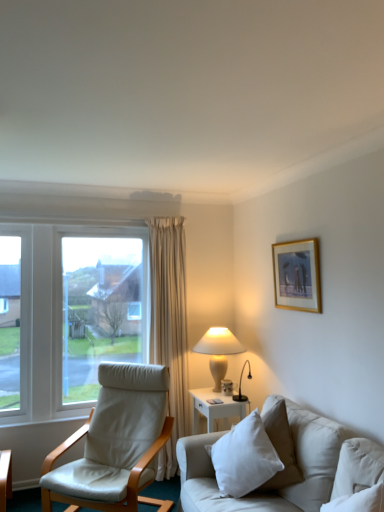
Describe the element at coordinates (358, 467) in the screenshot. I see `white soft pillow at lower right, the 1th pillow positioned from the front` at that location.

Describe the element at coordinates (297, 275) in the screenshot. The width and height of the screenshot is (384, 512). I see `gold-framed artwork at upper right` at that location.

At what (x,y) coordinates should I click in order to perform the action: click on white leather chair at left. Please return your answer as a coordinate pair (x, y). Image resolution: width=384 pixels, height=512 pixels. Looking at the image, I should click on (115, 443).

I want to click on white cotton pillow at lower right, which is the second pillow from right to left, so click(244, 457).

I want to click on white ceramic table lamp at center-right, so pos(218,351).

Can you confirm if white soft pillow at lower right, which is the second pillow in left-to-right order, is taller than white cotton pillow at lower right, the 1th pillow positioned from the left?

Incorrect, the height of white soft pillow at lower right, which is the second pillow in left-to-right order, is not larger of that of white cotton pillow at lower right, the 1th pillow positioned from the left.

Consider the image. Is white cotton pillow at lower right, the 1th pillow positioned from the left, at the back of white soft pillow at lower right, which is the second pillow in left-to-right order?

No, white soft pillow at lower right, which is the second pillow in left-to-right order, is not facing the opposite direction of white cotton pillow at lower right, the 1th pillow positioned from the left.

Is white soft pillow at lower right, the 1th pillow positioned from the front, bigger or smaller than white cotton pillow at lower right, the 1th pillow positioned from the left?

Considering their sizes, white soft pillow at lower right, the 1th pillow positioned from the front, takes up less space than white cotton pillow at lower right, the 1th pillow positioned from the left.

Considering the relative positions of white ceramic table lamp at center-right and white cotton pillow at lower right, the 2th pillow viewed from the front, in the image provided, is white ceramic table lamp at center-right to the left of white cotton pillow at lower right, the 2th pillow viewed from the front, from the viewer's perspective?

Yes.

Could you measure the distance between white ceramic table lamp at center-right and white cotton pillow at lower right, the 2th pillow viewed from the front?

white ceramic table lamp at center-right is 37.30 inches away from white cotton pillow at lower right, the 2th pillow viewed from the front.

From the picture: Is white ceramic table lamp at center-right directly adjacent to white cotton pillow at lower right, the 2th pillow viewed from the front?

No.

Which is behind, white ceramic table lamp at center-right or white cotton pillow at lower right, the 2th pillow viewed from the front?

white ceramic table lamp at center-right is further from the camera.

Is white soft pillow at lower right, the 1th pillow positioned from the front, positioned far away from white ceramic table lamp at center-right?

Indeed, white soft pillow at lower right, the 1th pillow positioned from the front, is not near white ceramic table lamp at center-right.

Which is behind, point (338, 471) or point (209, 334)?

Positioned behind is point (209, 334).

Is white soft pillow at lower right, positioned as the 2th pillow in back-to-front order, outside of white ceramic table lamp at center-right?

Yes, white soft pillow at lower right, positioned as the 2th pillow in back-to-front order, is not within white ceramic table lamp at center-right.

How many degrees apart are the facing directions of white soft pillow at lower right, which is the second pillow in left-to-right order, and white ceramic table lamp at center-right?

The angle between the facing direction of white soft pillow at lower right, which is the second pillow in left-to-right order, and the facing direction of white ceramic table lamp at center-right is 17.2 degrees.

Is point (124, 446) positioned behind point (233, 352)?

No, it is in front of (233, 352).

From a real-world perspective, which is physically below, white leather chair at left or white ceramic table lamp at center-right?

white leather chair at left.

Is white leather chair at left behind white ceramic table lamp at center-right?

That is False.

Is the surface of white leather chair at left in direct contact with white ceramic table lamp at center-right?

No, white leather chair at left is not touching white ceramic table lamp at center-right.

Looking at the image, does white cotton pillow at lower right, which is the second pillow from right to left, seem bigger or smaller compared to white soft pillow at lower right, positioned as the 2th pillow in back-to-front order?

In the image, white cotton pillow at lower right, which is the second pillow from right to left, appears to be larger than white soft pillow at lower right, positioned as the 2th pillow in back-to-front order.

Considering the positions of objects white cotton pillow at lower right, the 2th pillow viewed from the front, and white soft pillow at lower right, positioned as the 2th pillow in back-to-front order, in the image provided, who is more to the left, white cotton pillow at lower right, the 2th pillow viewed from the front, or white soft pillow at lower right, positioned as the 2th pillow in back-to-front order,?

From the viewer's perspective, white cotton pillow at lower right, the 2th pillow viewed from the front, appears more on the left side.

Which is behind, point (240, 483) or point (347, 490)?

The point (240, 483) is farther.

In the scene shown: Is white leather chair at left to the left or to the right of white soft pillow at lower right, which is the second pillow in left-to-right order, in the image?

In the image, white leather chair at left appears on the left side of white soft pillow at lower right, which is the second pillow in left-to-right order.

From a real-world perspective, which is physically above, white leather chair at left or white soft pillow at lower right, which is the 1th pillow from right to left?

From a 3D spatial view, white soft pillow at lower right, which is the 1th pillow from right to left, is above.

Would you say white leather chair at left is inside or outside white soft pillow at lower right, the 1th pillow positioned from the front?

white leather chair at left cannot be found inside white soft pillow at lower right, the 1th pillow positioned from the front.

Which of these two, white fabric couch at lower right or white cotton pillow at lower right, the 1th pillow from the back, is thinner?

white fabric couch at lower right.

Is white cotton pillow at lower right, which is the second pillow from right to left, at the back of white fabric couch at lower right?

Yes, white fabric couch at lower right is positioned with its back facing white cotton pillow at lower right, which is the second pillow from right to left.

Considering the relative positions of white fabric couch at lower right and white cotton pillow at lower right, the 2th pillow viewed from the front, in the image provided, is white fabric couch at lower right to the left or to the right of white cotton pillow at lower right, the 2th pillow viewed from the front,?

From the image, it's evident that white fabric couch at lower right is to the right of white cotton pillow at lower right, the 2th pillow viewed from the front.

Who is shorter, white fabric couch at lower right or white cotton pillow at lower right, which is the second pillow from right to left?

white cotton pillow at lower right, which is the second pillow from right to left, is shorter.

The height and width of the screenshot is (512, 384). I want to click on pillow that is on the right side of white cotton pillow at lower right, the 2th pillow viewed from the front, so click(x=358, y=467).

From the image's perspective, which pillow is the 2nd one below the white ceramic table lamp at center-right? Please provide its 2D coordinates.

[(244, 457)]

Considering their positions, is gold-framed artwork at upper right positioned closer to white ceramic table lamp at center-right than white fabric couch at lower right?

gold-framed artwork at upper right lies closer to white ceramic table lamp at center-right than the other object.

Consider the image. From the image, which object appears to be nearer to white leather chair at left, white soft pillow at lower right, positioned as the 2th pillow in back-to-front order, or white ceramic table lamp at center-right?

Among the two, white ceramic table lamp at center-right is located nearer to white leather chair at left.

From the image, which object appears to be nearer to white cotton pillow at lower right, the 1th pillow positioned from the left, white fabric couch at lower right or white soft pillow at lower right, the 1th pillow positioned from the front?

white fabric couch at lower right is positioned closer to the anchor white cotton pillow at lower right, the 1th pillow positioned from the left.

When comparing their distances from white fabric couch at lower right, does gold-framed artwork at upper right or white leather chair at left seem closer?

The object closer to white fabric couch at lower right is white leather chair at left.

Looking at the image, which one is located closer to white soft pillow at lower right, the 1th pillow positioned from the front, white leather chair at left or gold-framed artwork at upper right?

Based on the image, gold-framed artwork at upper right appears to be nearer to white soft pillow at lower right, the 1th pillow positioned from the front.

Considering their positions, is white leather chair at left positioned further to white ceramic table lamp at center-right than white cotton pillow at lower right, which is the second pillow from right to left?

white cotton pillow at lower right, which is the second pillow from right to left, is further to white ceramic table lamp at center-right.

Estimate the real-world distances between objects in this image. Which object is further from white soft pillow at lower right, positioned as the 2th pillow in back-to-front order, gold-framed artwork at upper right or white cotton pillow at lower right, which is the second pillow from right to left?

gold-framed artwork at upper right is further to white soft pillow at lower right, positioned as the 2th pillow in back-to-front order.

Considering their positions, is white cotton pillow at lower right, the 1th pillow positioned from the left, positioned further to white leather chair at left than white fabric couch at lower right?

Among the two, white cotton pillow at lower right, the 1th pillow positioned from the left, is located further to white leather chair at left.

This screenshot has height=512, width=384. I want to click on table lamp between gold-framed artwork at upper right and white fabric couch at lower right vertically, so click(x=218, y=351).

Find the location of a particular element. Image resolution: width=384 pixels, height=512 pixels. studio couch between white soft pillow at lower right, which is the 1th pillow from right to left, and white ceramic table lamp at center-right in the front-back direction is located at coordinates coord(296,462).

Identify the location of pillow situated between white leather chair at left and white fabric couch at lower right from left to right. The height and width of the screenshot is (512, 384). (244, 457).

At what (x,y) coordinates should I click in order to perform the action: click on pillow located between white leather chair at left and gold-framed artwork at upper right in the left-right direction. Please return your answer as a coordinate pair (x, y). Looking at the image, I should click on (244, 457).